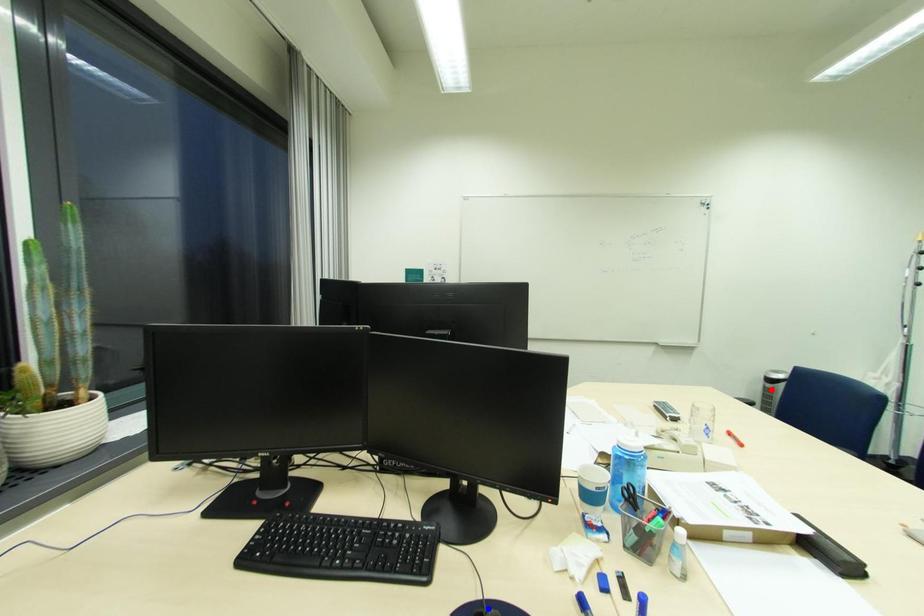
Question: Which of the two points in the image is closer to the camera?

Choices:
 (A) Blue point is closer.
 (B) Red point is closer.

Answer: (A)